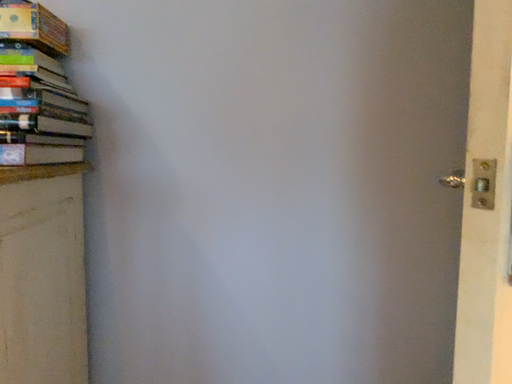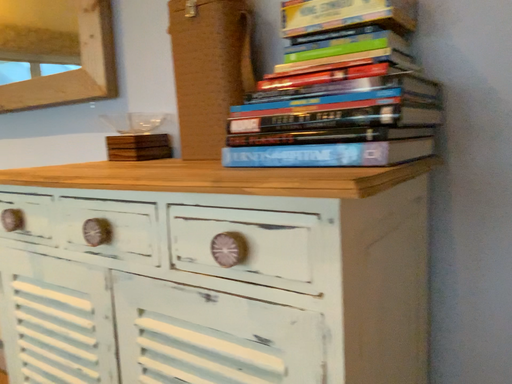
Question: How did the camera likely rotate when shooting the video?

Choices:
 (A) rotated right
 (B) rotated left

Answer: (B)